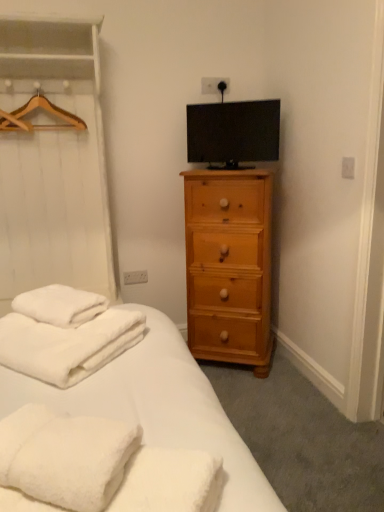
Question: From the image's perspective, is wooden hanger at upper left below matte black tv at upper center?

Choices:
 (A) yes
 (B) no

Answer: (B)

Question: From the image's perspective, is wooden hanger at upper left on matte black tv at upper center?

Choices:
 (A) yes
 (B) no

Answer: (A)

Question: Can matte black tv at upper center be found inside wooden hanger at upper left?

Choices:
 (A) yes
 (B) no

Answer: (B)

Question: Is the position of wooden hanger at upper left more distant than that of matte black tv at upper center?

Choices:
 (A) yes
 (B) no

Answer: (B)

Question: Are wooden hanger at upper left and matte black tv at upper center located far from each other?

Choices:
 (A) yes
 (B) no

Answer: (B)

Question: Is wooden hanger at upper left turned away from matte black tv at upper center?

Choices:
 (A) yes
 (B) no

Answer: (B)

Question: From the image's perspective, is light brown wood chest of drawers at right located beneath white fluffy towels at lower left?

Choices:
 (A) yes
 (B) no

Answer: (B)

Question: Is light brown wood chest of drawers at right far from white fluffy towels at lower left?

Choices:
 (A) no
 (B) yes

Answer: (B)

Question: Is light brown wood chest of drawers at right oriented towards white fluffy towels at lower left?

Choices:
 (A) yes
 (B) no

Answer: (A)

Question: Considering the relative positions of light brown wood chest of drawers at right and white fluffy towels at lower left in the image provided, is light brown wood chest of drawers at right in front of white fluffy towels at lower left?

Choices:
 (A) no
 (B) yes

Answer: (A)

Question: Considering the relative sizes of light brown wood chest of drawers at right and white fluffy towels at lower left in the image provided, is light brown wood chest of drawers at right thinner than white fluffy towels at lower left?

Choices:
 (A) no
 (B) yes

Answer: (B)

Question: Is light brown wood chest of drawers at right at the left side of white fluffy towels at lower left?

Choices:
 (A) no
 (B) yes

Answer: (A)

Question: From the image's perspective, is light brown wood chest of drawers at right under matte black tv at upper center?

Choices:
 (A) yes
 (B) no

Answer: (A)